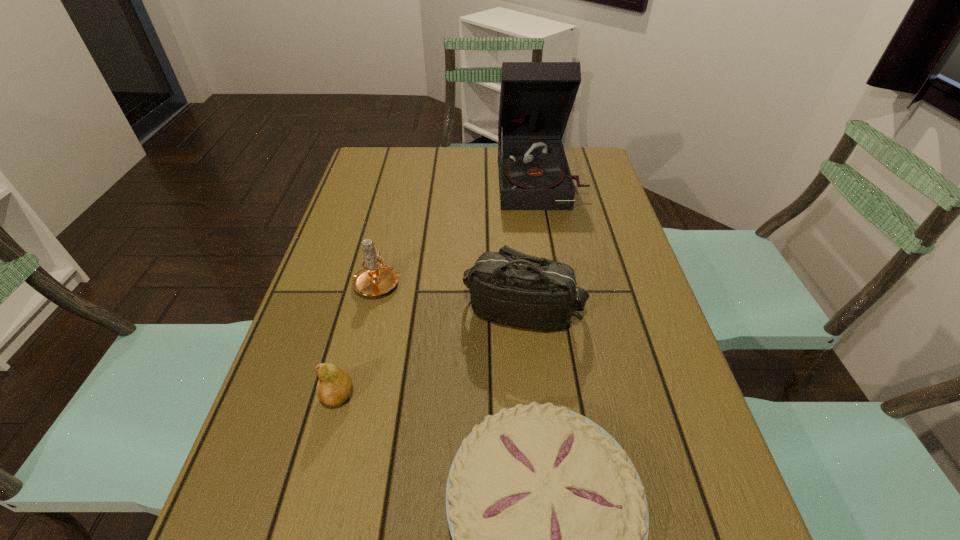
The image size is (960, 540). Find the location of `the tallest object`. the tallest object is located at coordinates (536, 98).

Identify the location of the farthest object. Image resolution: width=960 pixels, height=540 pixels. (536, 98).

The width and height of the screenshot is (960, 540). I want to click on shoulder bag, so click(x=508, y=287).

What are the coordinates of `candle` in the screenshot? It's located at (374, 278).

Identify the location of the second nearest object. Image resolution: width=960 pixels, height=540 pixels. (334, 386).

Where is `blank space located on the front-facing side of the tallest object`? blank space located on the front-facing side of the tallest object is located at coordinates (558, 275).

The image size is (960, 540). What are the coordinates of `free location located at the front padded panel of the fourth shortest object` in the screenshot? It's located at (538, 467).

Locate an element on the screen. The height and width of the screenshot is (540, 960). vacant space located on the right of the candle is located at coordinates (445, 281).

Identify the location of free point located 0.080m on the back of the second nearest object. This screenshot has height=540, width=960. (350, 348).

Locate an element on the screen. This screenshot has height=540, width=960. object present at the far edge is located at coordinates (536, 98).